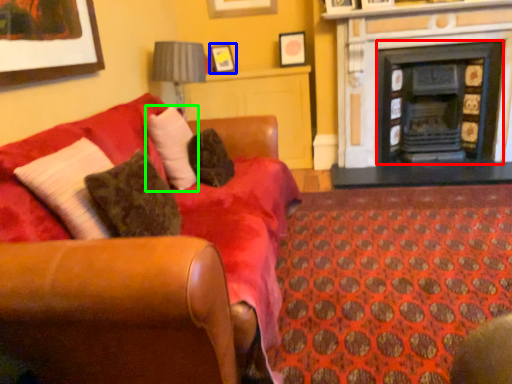
Question: Estimate the real-world distances between objects in this image. Which object is farther from fireplace (highlighted by a red box), picture frame (highlighted by a blue box) or pillow (highlighted by a green box)?

Choices:
 (A) picture frame
 (B) pillow

Answer: (B)